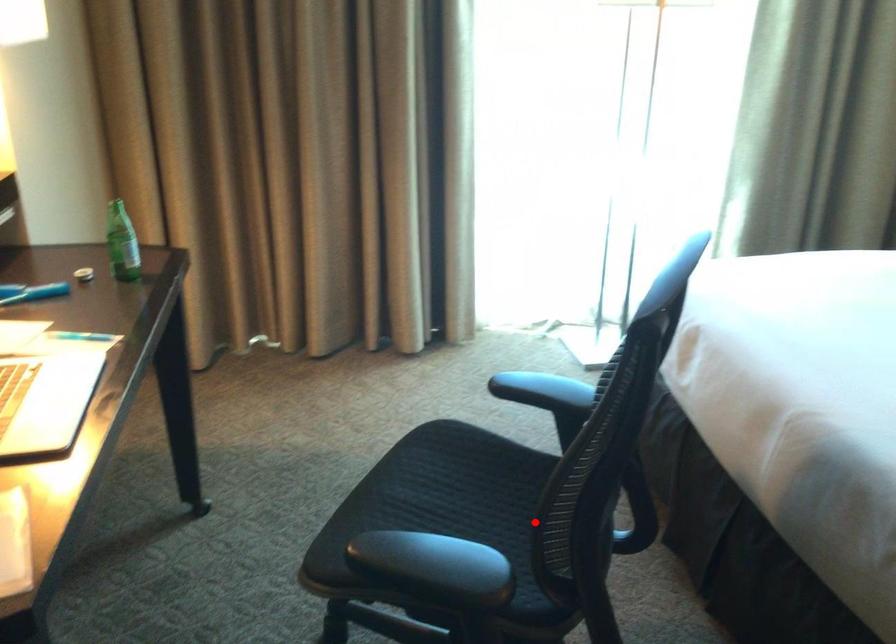
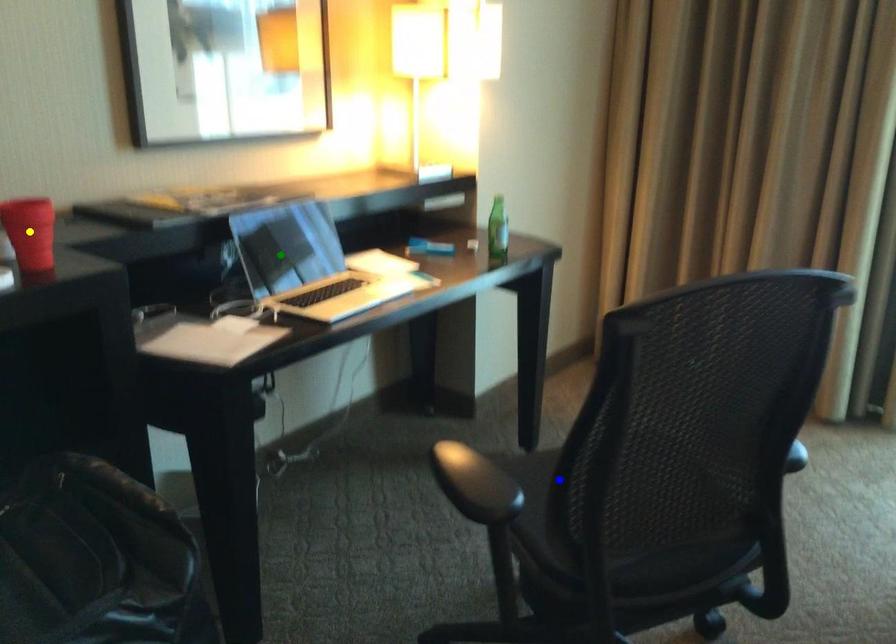
Question: I am providing you with two images of the same scene from different viewpoints. A red point is marked on the first image. You are given multiple points on the second image. Can you choose the point in image 2 that corresponds to the point in image 1?

Choices:
 (A) yellow point
 (B) blue point
 (C) green point

Answer: (B)